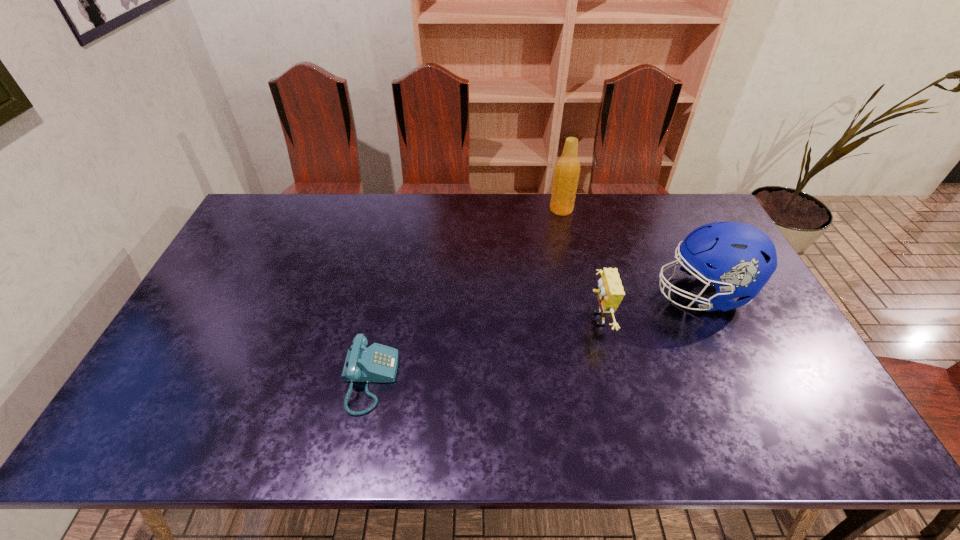
At what (x,y) coordinates should I click in order to perform the action: click on free region located 0.270m on the face of the second shortest object. Please return your answer as a coordinate pair (x, y). The image size is (960, 540). Looking at the image, I should click on 490,319.

At what (x,y) coordinates should I click in order to perform the action: click on vacant region located on the face of the second shortest object. Please return your answer as a coordinate pair (x, y). This screenshot has height=540, width=960. Looking at the image, I should click on (536, 319).

At what (x,y) coordinates should I click in order to perform the action: click on blank area located 0.200m on the dial of the leftmost object. Please return your answer as a coordinate pair (x, y). Looking at the image, I should click on (476, 380).

The height and width of the screenshot is (540, 960). Find the location of `object located at the far edge`. object located at the far edge is located at coordinates tap(567, 169).

You are a GUI agent. You are given a task and a screenshot of the screen. Output one action in this format:
    pyautogui.click(x=<x>, y=<y>)
    Task: Click on the object at the near edge
    The width and height of the screenshot is (960, 540).
    Given the screenshot: What is the action you would take?
    pyautogui.click(x=378, y=363)

Find the location of a particular element. This screenshot has height=540, width=960. object situated at the right edge is located at coordinates (738, 259).

At what (x,y) coordinates should I click in order to perform the action: click on free space at the far edge of the desktop. Please return your answer as a coordinate pair (x, y). This screenshot has height=540, width=960. Looking at the image, I should click on (459, 207).

This screenshot has height=540, width=960. Identify the location of vacant space at the near edge of the desktop. (x=410, y=424).

You are a GUI agent. You are given a task and a screenshot of the screen. Output one action in this format:
    pyautogui.click(x=<x>, y=<y>)
    Task: Click on the free location at the left edge
    This screenshot has height=540, width=960.
    Given the screenshot: What is the action you would take?
    pyautogui.click(x=246, y=273)

This screenshot has width=960, height=540. Find the location of `empty space between the leftmost object and the rightmost object`. empty space between the leftmost object and the rightmost object is located at coordinates (536, 336).